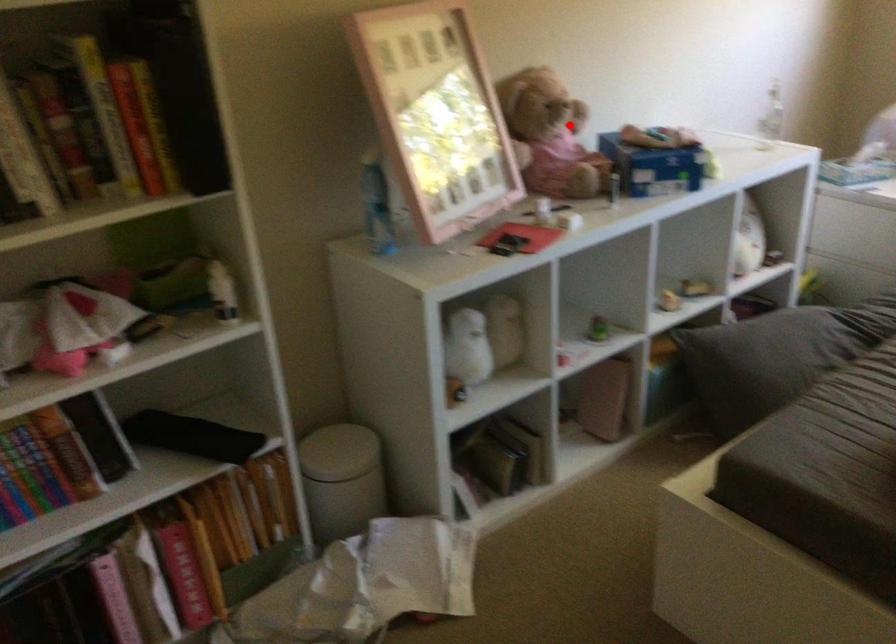
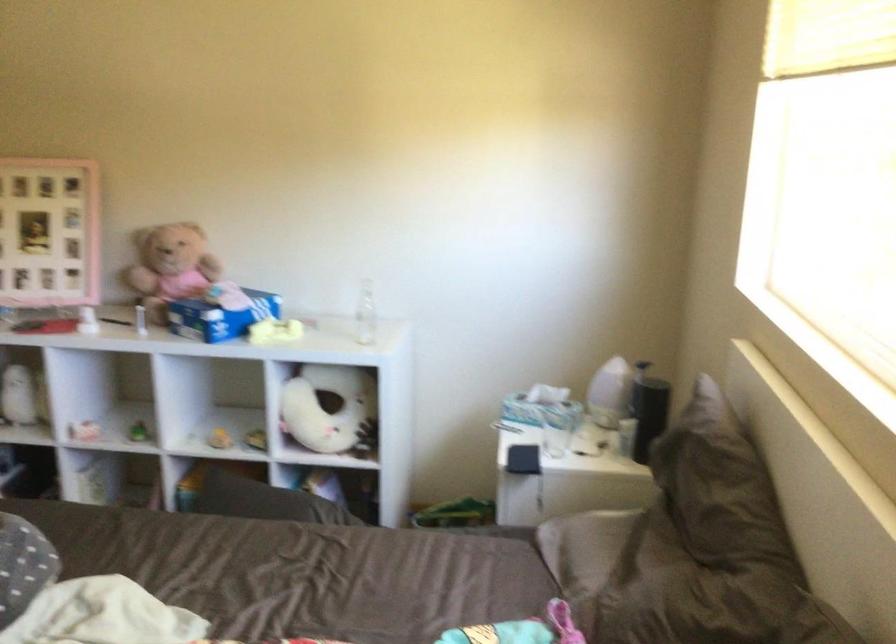
Where in the second image is the point corresponding to the highlighted location from the first image?

(170, 267)